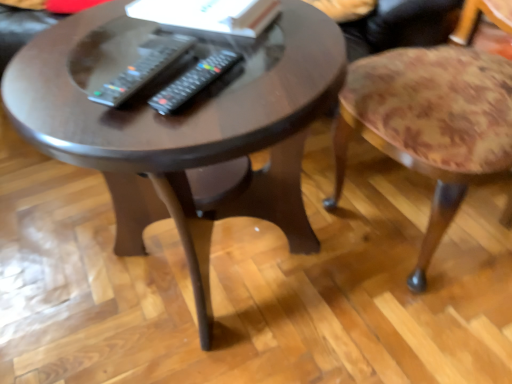
Find the location of a particular element. The image size is (512, 384). free spot in front of black plastic remote at center, acting as the 1th remote starting from the right is located at coordinates (192, 124).